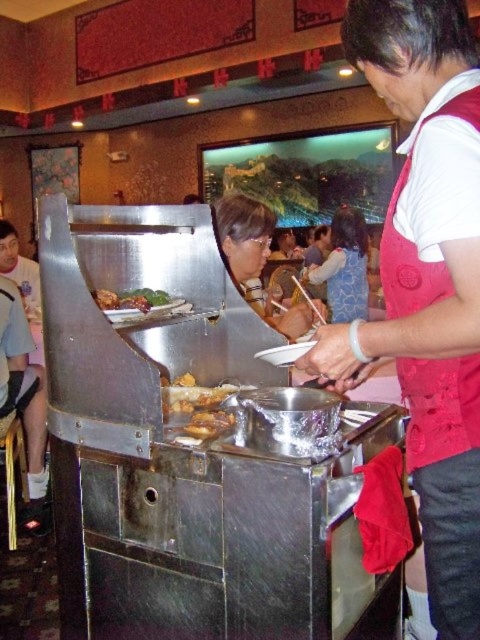
You are a customer at the buffet and want to grab a plate from the brushed metal buffet at center before the matte black shirt at center does. Which object is larger and can you reach it first?

The brushed metal buffet at center is bigger than the matte black shirt at center, so you can reach it first since it is larger and more accessible.

You are a customer waiting in line at the food service area. You notice the red apron waiter at right and the shiny brown meat at center. Which object is taller?

The red apron waiter at right is taller than the shiny brown meat at center.

You are standing at the food station and want to grab a plate from the nearest point. Which point should you approach first, point (98, 387) or point (4, 237)?

Point (98, 387) is closer to the viewer than point (4, 237), so you should approach point (98, 387) first.